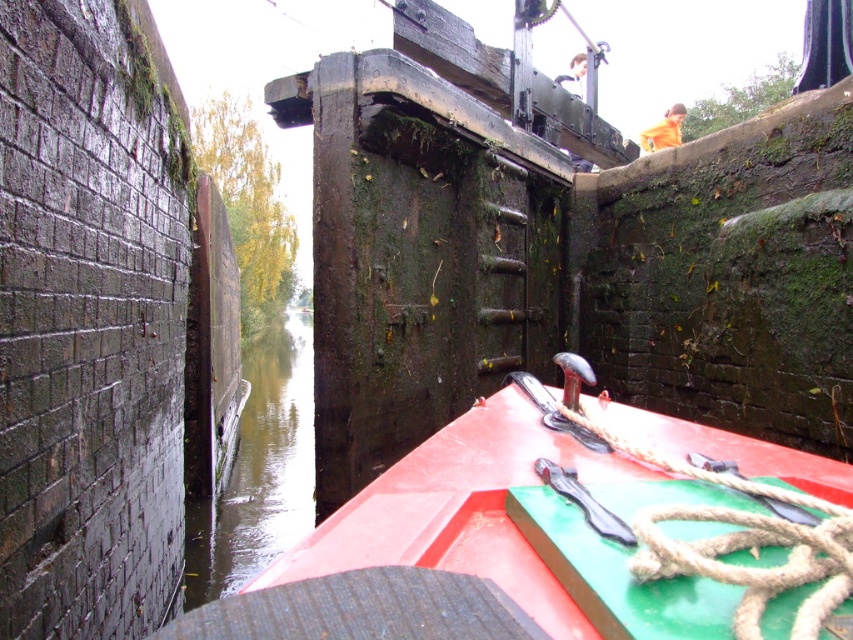
Question: Among these points, which one is nearest to the camera?

Choices:
 (A) (496, 579)
 (B) (283, 452)

Answer: (A)

Question: Is red matte boat at center wider than roperoughrope at center?

Choices:
 (A) no
 (B) yes

Answer: (B)

Question: Can you confirm if roperoughrope at center is wider than greenish water at center?

Choices:
 (A) no
 (B) yes

Answer: (A)

Question: Which object is positioned farthest from the greenish water at center?

Choices:
 (A) red matte boat at center
 (B) roperoughrope at center

Answer: (B)

Question: Which point appears closest to the camera in this image?

Choices:
 (A) (785, 609)
 (B) (186, 609)
 (C) (521, 472)

Answer: (A)

Question: Does roperoughrope at center have a lesser width compared to greenish water at center?

Choices:
 (A) yes
 (B) no

Answer: (A)